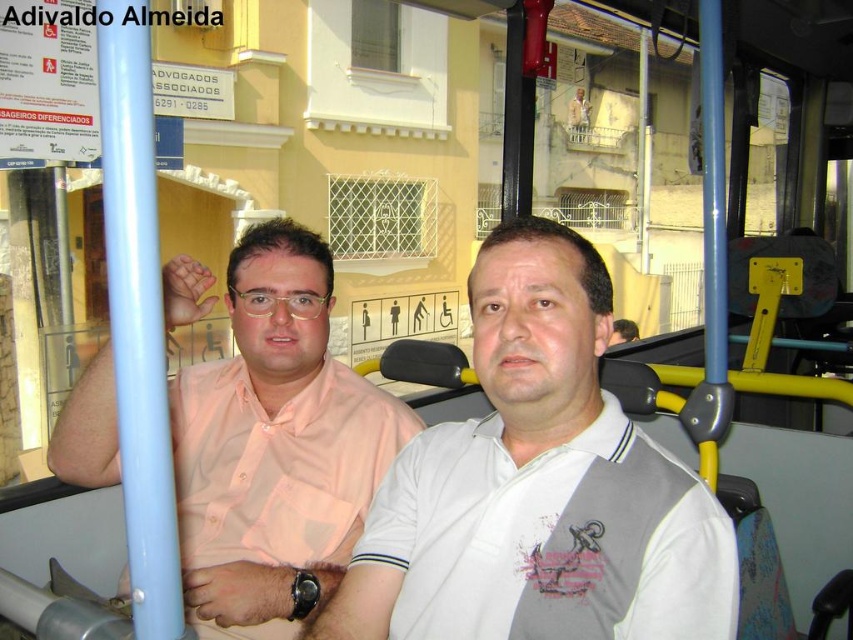
You are a passenger on a bus and you see a white cotton shirt at center and a pink shirt at left. Which shirt is smaller in size?

The white cotton shirt at center is smaller in size compared to the pink shirt at left.

You are a passenger on the bus and want to know which of the two points, point [672,536] or point [308,493], is closer to you. Based on the scene description, which point is closer?

Point [672,536] is closer to the viewer than point [308,493].

You are a bus passenger who wants to know if the white cotton shirt at center is taller than the pink shirt at left. Based on the scene, what can you determine?

The white cotton shirt at center is not as tall as pink shirt at left, so the pink shirt at left is taller.